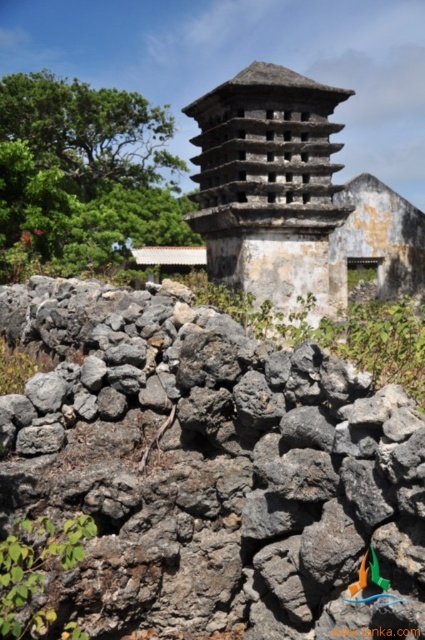
Question: Is volcanic rock wall at center smaller than gray stone tower at center?

Choices:
 (A) yes
 (B) no

Answer: (A)

Question: Where is volcanic rock wall at center located in relation to gray stone tower at center in the image?

Choices:
 (A) above
 (B) below

Answer: (B)

Question: Can you confirm if volcanic rock wall at center is positioned to the right of gray stone tower at center?

Choices:
 (A) no
 (B) yes

Answer: (A)

Question: Which of the following is the closest to the observer?

Choices:
 (A) gray stone tower at center
 (B) volcanic rock wall at center

Answer: (B)